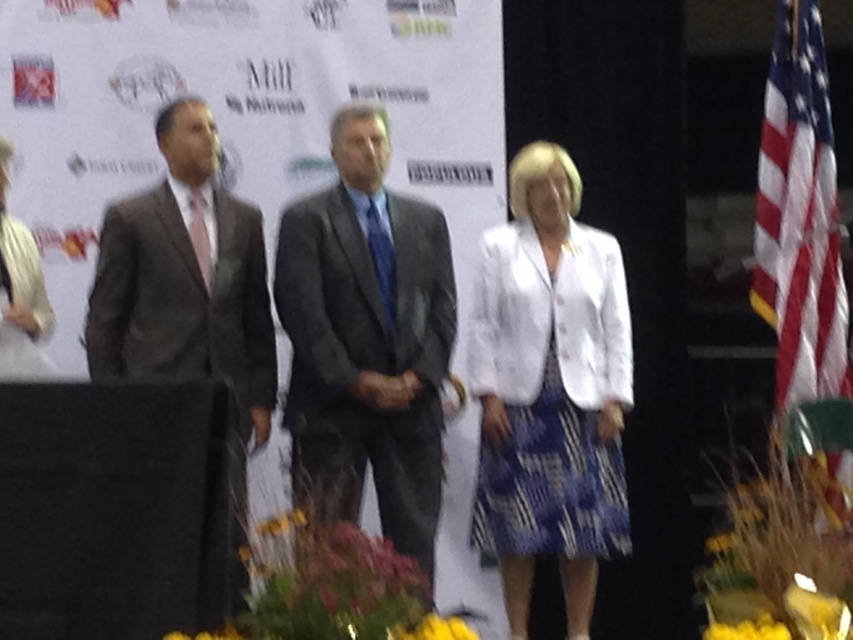
You are a photographer at a formal event. You need to capture a photo where the dark gray textured suit at left and the yellow fabric flower at lower center are both visible. Based on their positions, which object is closer to the camera?

The dark gray textured suit at left is closer to the camera because it is positioned over the yellow fabric flower at lower center, indicating it is in front.

You are an event photographer who needs to capture a closeup of the yellow fabric flower at lower center while ensuring the dark gray textured suit at left is still visible in the frame. Is the flower large enough to focus on without cropping the suit out?

The dark gray textured suit at left is wider than the yellow fabric flower at lower center. Since the flower is smaller, you can focus on it while keeping the suit in the frame without cropping.

You are an event photographer at the back of the stage. You need to capture a closeup shot of the yellow fabric flower at lower center while ensuring the dark gray suit at center is still visible in the frame. Is the flower positioned in a way that allows both elements to be in the same photo?

The dark gray suit at center is located above the yellow fabric flower at lower center, so yes, the flower can be captured in the lower part of the frame while the suit remains visible above it.